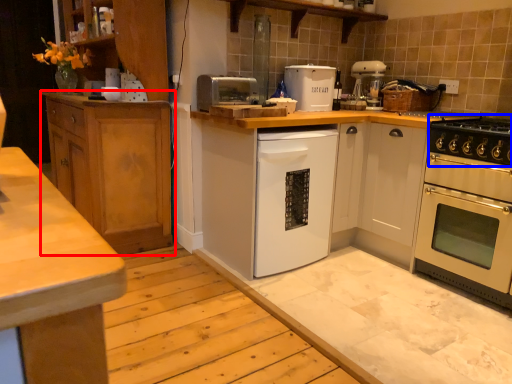
Question: Which of the following is the farthest to the observer, cabinetry (highlighted by a red box) or gas stove (highlighted by a blue box)?

Choices:
 (A) cabinetry
 (B) gas stove

Answer: (A)